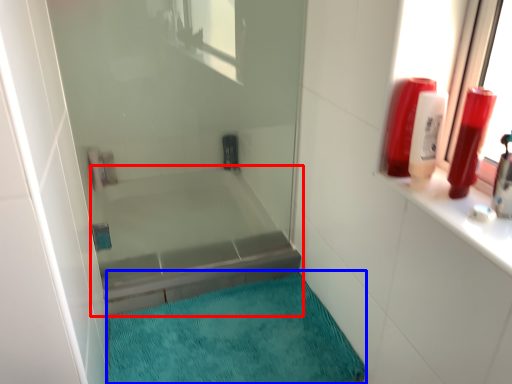
Question: Among these objects, which one is nearest to the camera, bathtub (highlighted by a red box) or bath mat (highlighted by a blue box)?

Choices:
 (A) bathtub
 (B) bath mat

Answer: (B)